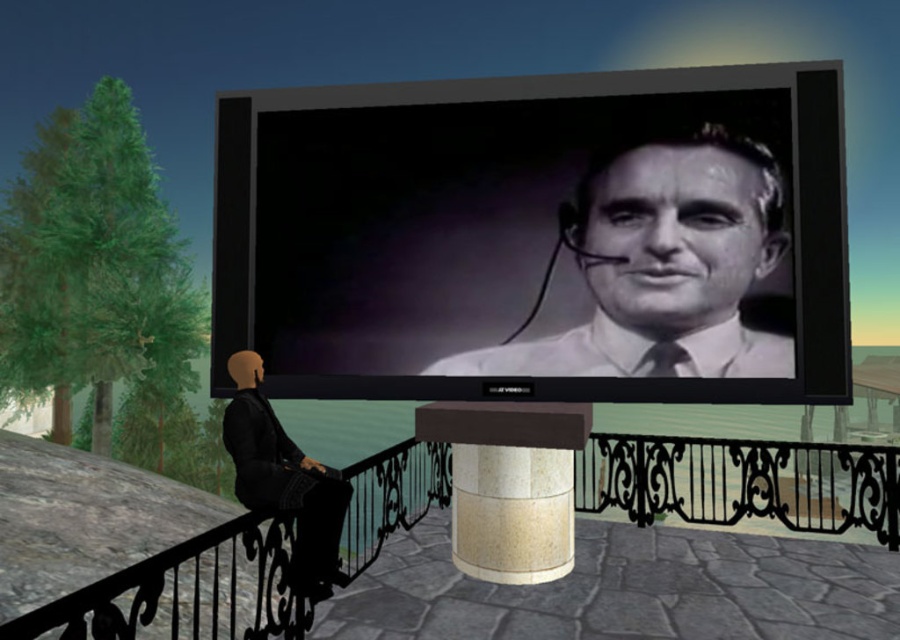
Question: Does black wrought iron balustrade at lower center appear on the right side of black matte/texture man at upper center?

Choices:
 (A) yes
 (B) no

Answer: (A)

Question: Which point is closer to the camera?

Choices:
 (A) black matte/texture man at upper center
 (B) black glossy screen at center
 (C) black fabric jacket at lower left

Answer: (C)

Question: Is black wrought iron balustrade at lower center thinner than beige marble pillar at center?

Choices:
 (A) no
 (B) yes

Answer: (A)

Question: Estimate the real-world distances between objects in this image. Which object is closer to the black wrought iron balustrade at lower center?

Choices:
 (A) black glossy screen at center
 (B) beige marble pillar at center
 (C) black matte/texture man at upper center

Answer: (B)

Question: Is black glossy screen at center below black fabric jacket at lower left?

Choices:
 (A) no
 (B) yes

Answer: (A)

Question: Which point is closer to the camera?

Choices:
 (A) (433, 456)
 (B) (294, 572)

Answer: (B)